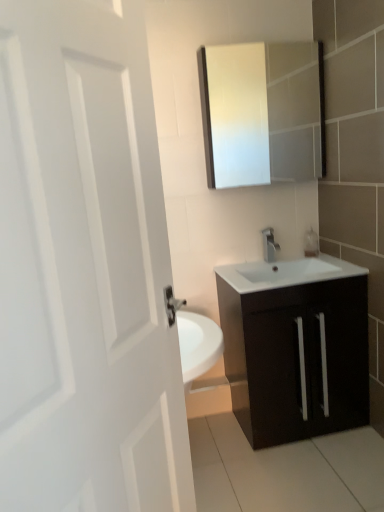
Question: From a real-world perspective, does clear glass soap dispenser at right stand above white matte door at left?

Choices:
 (A) yes
 (B) no

Answer: (B)

Question: Could you tell me if clear glass soap dispenser at right is turned towards white matte door at left?

Choices:
 (A) yes
 (B) no

Answer: (B)

Question: Is the depth of clear glass soap dispenser at right less than that of white matte door at left?

Choices:
 (A) yes
 (B) no

Answer: (B)

Question: Does clear glass soap dispenser at right have a greater width compared to white matte door at left?

Choices:
 (A) yes
 (B) no

Answer: (B)

Question: Is clear glass soap dispenser at right shorter than white matte door at left?

Choices:
 (A) yes
 (B) no

Answer: (A)

Question: Can you confirm if clear glass soap dispenser at right is bigger than white matte door at left?

Choices:
 (A) no
 (B) yes

Answer: (A)

Question: From the image's perspective, is white matte door at left over silver metallic tap at center?

Choices:
 (A) yes
 (B) no

Answer: (B)

Question: Is white matte door at left to the right of silver metallic tap at center from the viewer's perspective?

Choices:
 (A) no
 (B) yes

Answer: (A)

Question: Considering the relative sizes of white matte door at left and silver metallic tap at center in the image provided, is white matte door at left smaller than silver metallic tap at center?

Choices:
 (A) yes
 (B) no

Answer: (B)

Question: From the image's perspective, is white matte door at left below silver metallic tap at center?

Choices:
 (A) no
 (B) yes

Answer: (B)

Question: Considering the relative sizes of white matte door at left and silver metallic tap at center in the image provided, is white matte door at left thinner than silver metallic tap at center?

Choices:
 (A) no
 (B) yes

Answer: (A)

Question: Can silver metallic tap at center be found inside white matte door at left?

Choices:
 (A) no
 (B) yes

Answer: (A)

Question: Is matte dark wood cabinet at lower right positioned in front of clear glass soap dispenser at right?

Choices:
 (A) no
 (B) yes

Answer: (B)